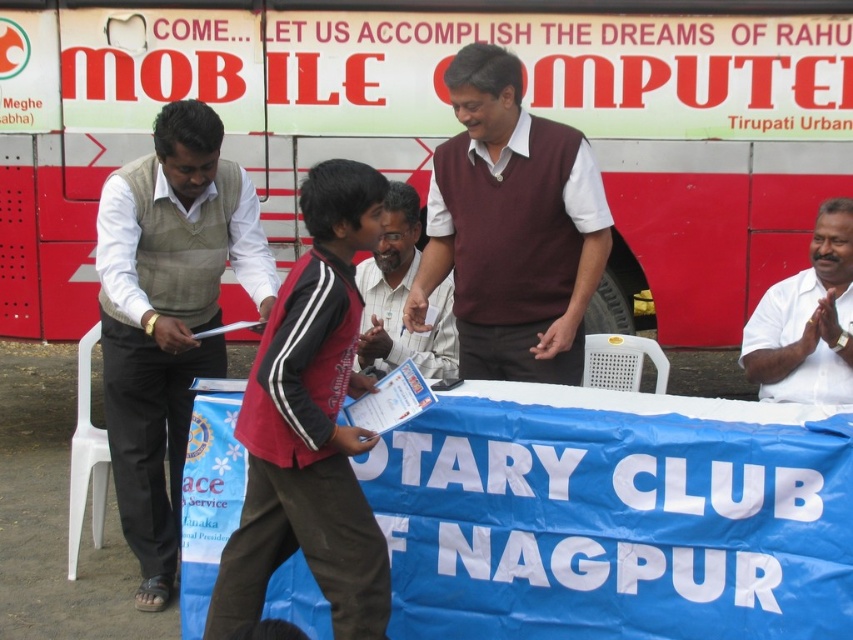
Question: Does dark red jacket at center have a lesser width compared to white matte shirt at right?

Choices:
 (A) no
 (B) yes

Answer: (A)

Question: Is the position of dark red jacket at center less distant than that of white matte shirt at right?

Choices:
 (A) yes
 (B) no

Answer: (A)

Question: Among these objects, which one is nearest to the camera?

Choices:
 (A) white matte shirt at right
 (B) white matte shirt at center
 (C) red painted bus at upper center
 (D) light brown vest at left

Answer: (A)

Question: Which point is closer to the camera?

Choices:
 (A) (35, 163)
 (B) (126, 285)
 (C) (496, 369)
 (D) (767, 316)

Answer: (B)

Question: Can you confirm if light brown vest at left is positioned to the right of dark red jacket at center?

Choices:
 (A) yes
 (B) no

Answer: (B)

Question: Which point is closer to the camera?

Choices:
 (A) dark red jacket at center
 (B) white matte shirt at center

Answer: (A)